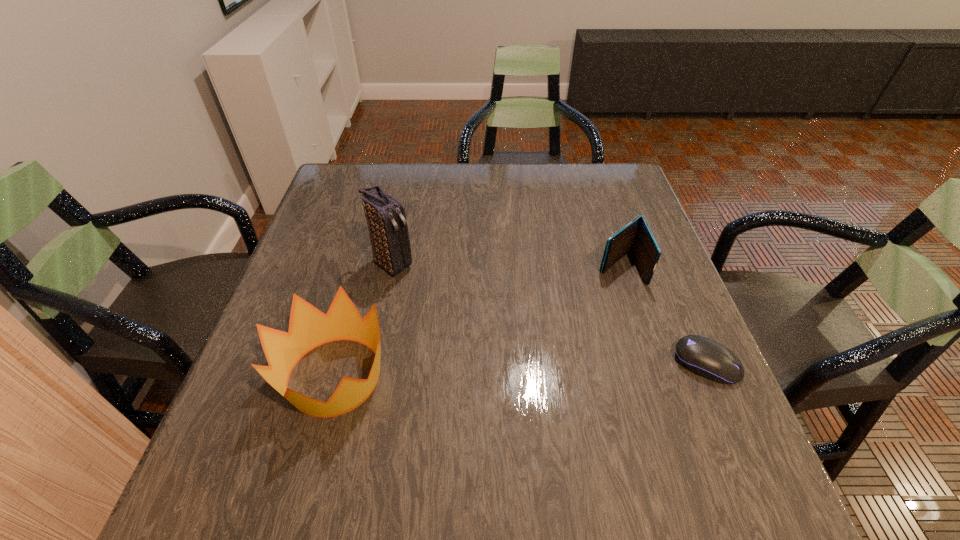
The height and width of the screenshot is (540, 960). Find the location of `empty space that is in between the clutch bag and the computer mouse`. empty space that is in between the clutch bag and the computer mouse is located at coordinates (x=550, y=314).

Find the location of a particular element. This screenshot has width=960, height=540. free space that is in between the shortest object and the wallet is located at coordinates (663, 315).

The image size is (960, 540). In order to click on object that is the closest to the clutch bag in this screenshot , I will do `click(309, 328)`.

Where is `the second closest object to the clutch bag`? This screenshot has height=540, width=960. the second closest object to the clutch bag is located at coordinates (637, 237).